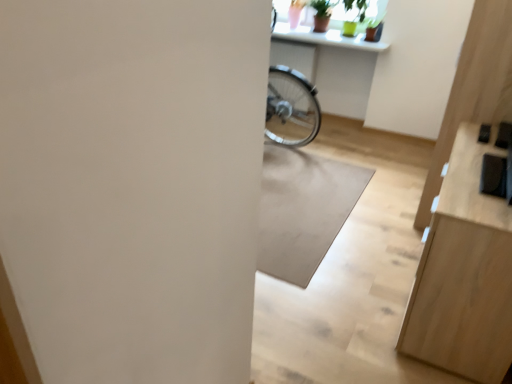
Where is `vacant space situated on the left part of light wood dresser at right`? The image size is (512, 384). vacant space situated on the left part of light wood dresser at right is located at coordinates (347, 303).